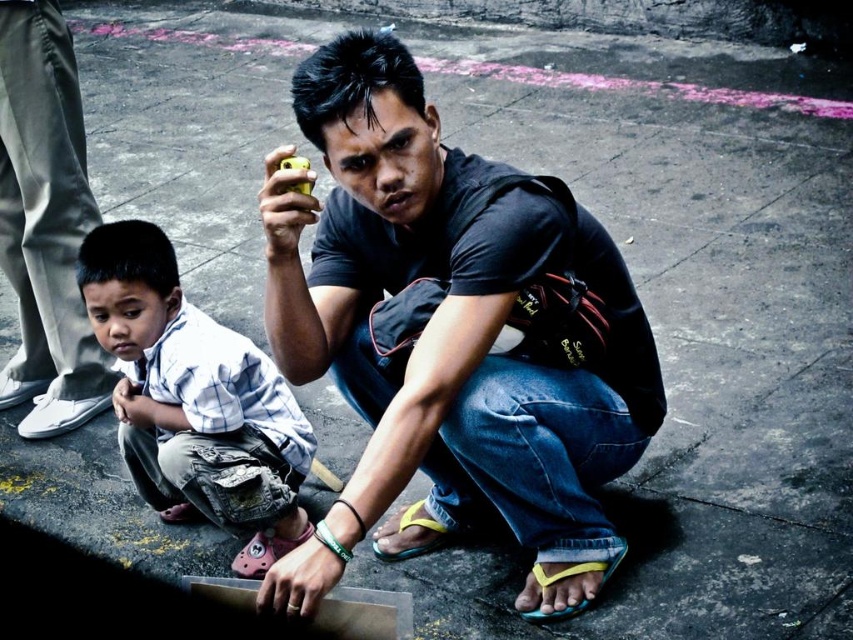
Is point (370, 392) farther from viewer compared to point (4, 257)?

No, it is not.

Does black matte shirt at center appear on the left side of matte black shirt at lower center?

Incorrect, black matte shirt at center is not on the left side of matte black shirt at lower center.

Who is more forward, (537,234) or (10,76)?

Point (537,234) is more forward.

Find the location of a particular element. The width and height of the screenshot is (853, 640). black matte shirt at center is located at coordinates (451, 336).

Does black matte shirt at center have a greater width compared to white checkered shirt at lower left?

Correct, the width of black matte shirt at center exceeds that of white checkered shirt at lower left.

Which is above, black matte shirt at center or white checkered shirt at lower left?

black matte shirt at center is above.

The height and width of the screenshot is (640, 853). I want to click on black matte shirt at center, so click(x=451, y=336).

The height and width of the screenshot is (640, 853). Find the location of `black matte shirt at center`. black matte shirt at center is located at coordinates (451, 336).

Between white checkered shirt at lower left and matte black shirt at lower center, which one is positioned higher?

Positioned higher is matte black shirt at lower center.

Is white checkered shirt at lower left further to the viewer compared to matte black shirt at lower center?

No, it is not.

What do you see at coordinates (194, 400) in the screenshot?
I see `white checkered shirt at lower left` at bounding box center [194, 400].

Locate an element on the screen. white checkered shirt at lower left is located at coordinates (194, 400).